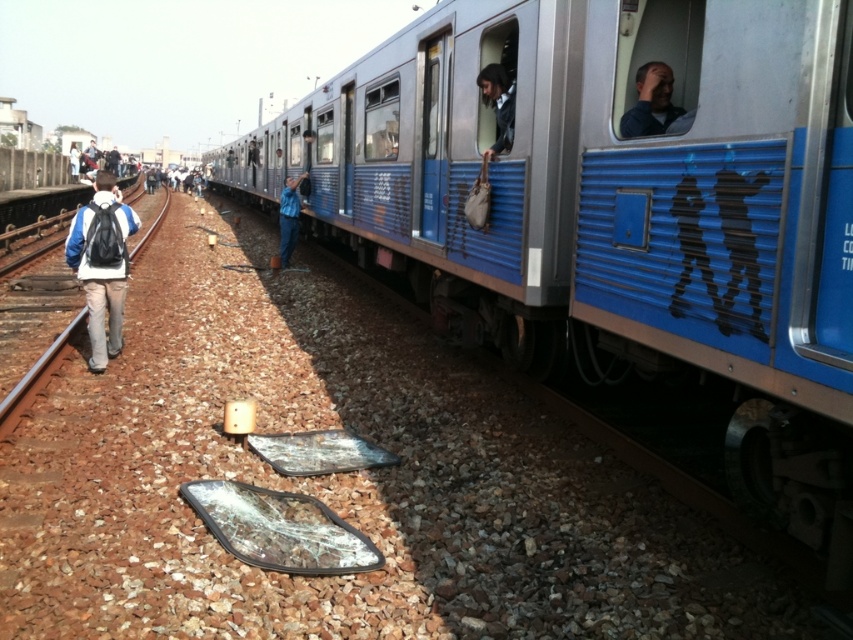
Question: Is metallic blue train at center to the right of brown gravel train track at left from the viewer's perspective?

Choices:
 (A) no
 (B) yes

Answer: (B)

Question: Is blue fabric backpack at left further to camera compared to blue uniformed worker at center?

Choices:
 (A) no
 (B) yes

Answer: (A)

Question: Which of the following is the farthest from the observer?

Choices:
 (A) (653, 72)
 (B) (560, 227)
 (C) (50, 358)
 (D) (198, 184)

Answer: (D)

Question: Which object is positioned closest to the blue fabric shirt at upper center?

Choices:
 (A) metallic blue train at center
 (B) brown gravel train track at left
 (C) blue fabric backpack at left

Answer: (A)

Question: Which object is positioned closest to the brown gravel train track at left?

Choices:
 (A) metallic blue train at center
 (B) blue fabric shirt at upper center
 (C) blue fabric jacket at center
 (D) blue uniformed worker at center

Answer: (A)

Question: Is blue fabric backpack at left thinner than brown gravel train track at left?

Choices:
 (A) no
 (B) yes

Answer: (B)